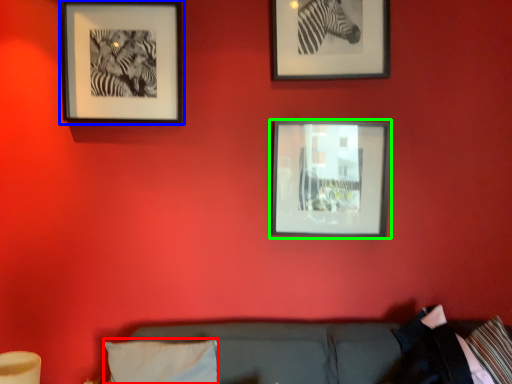
Question: Based on their relative distances, which object is nearer to pillow (highlighted by a red box)? Choose from picture frame (highlighted by a blue box) and picture frame (highlighted by a green box).

Choices:
 (A) picture frame
 (B) picture frame

Answer: (B)